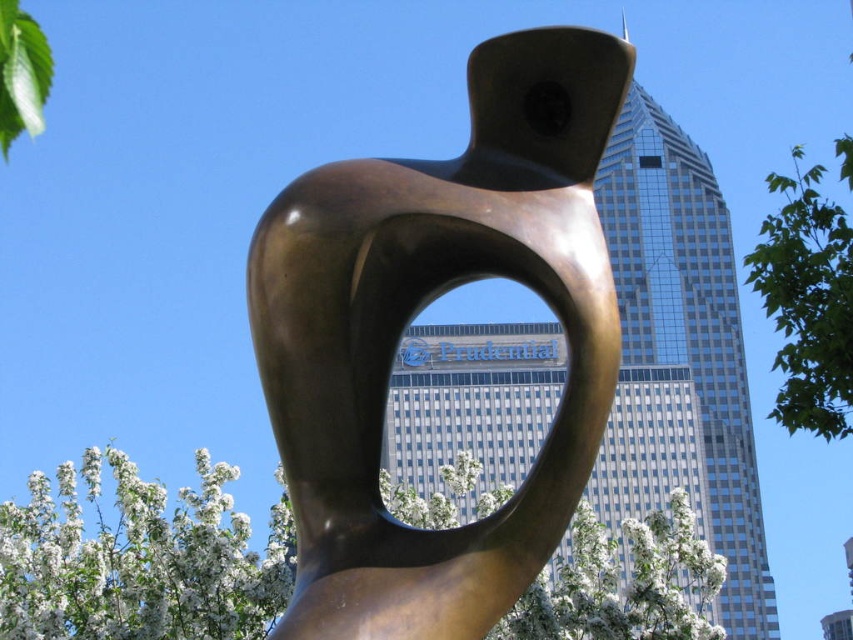
Question: Which point is farther from the camera taking this photo?

Choices:
 (A) (30, 70)
 (B) (166, 630)
 (C) (583, 120)
 (D) (830, 358)

Answer: (A)

Question: Which object is positioned farthest from the green leafy tree at upper left?

Choices:
 (A) bronze sculpture at center
 (B) white blossoms at center
 (C) green leafy tree at right

Answer: (A)

Question: Can you confirm if green leafy tree at right is positioned below green leafy tree at upper left?

Choices:
 (A) no
 (B) yes

Answer: (B)

Question: Can you confirm if white blossoms at center is bigger than green leafy tree at upper left?

Choices:
 (A) no
 (B) yes

Answer: (B)

Question: Does white blossoms at center have a larger size compared to green leafy tree at right?

Choices:
 (A) no
 (B) yes

Answer: (B)

Question: Which is nearer to the white blossoms at center?

Choices:
 (A) green leafy tree at upper left
 (B) bronze sculpture at center
 (C) green leafy tree at right

Answer: (C)